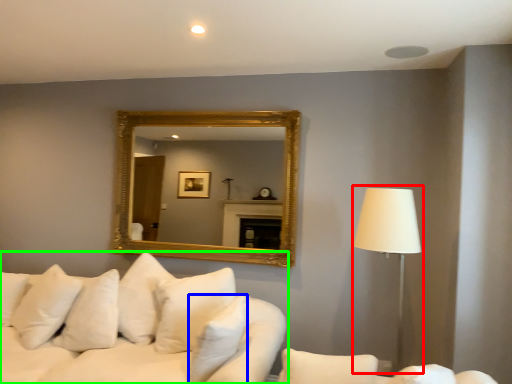
Question: Which is farther away from table lamp (highlighted by a red box)? pillow (highlighted by a blue box) or studio couch (highlighted by a green box)?

Choices:
 (A) pillow
 (B) studio couch

Answer: (B)